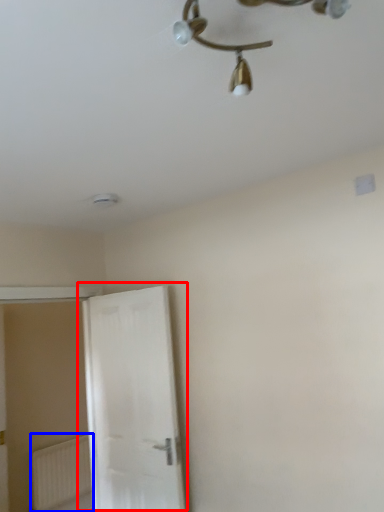
Question: Which object is further to the camera taking this photo, door (highlighted by a red box) or radiator (highlighted by a blue box)?

Choices:
 (A) door
 (B) radiator

Answer: (B)